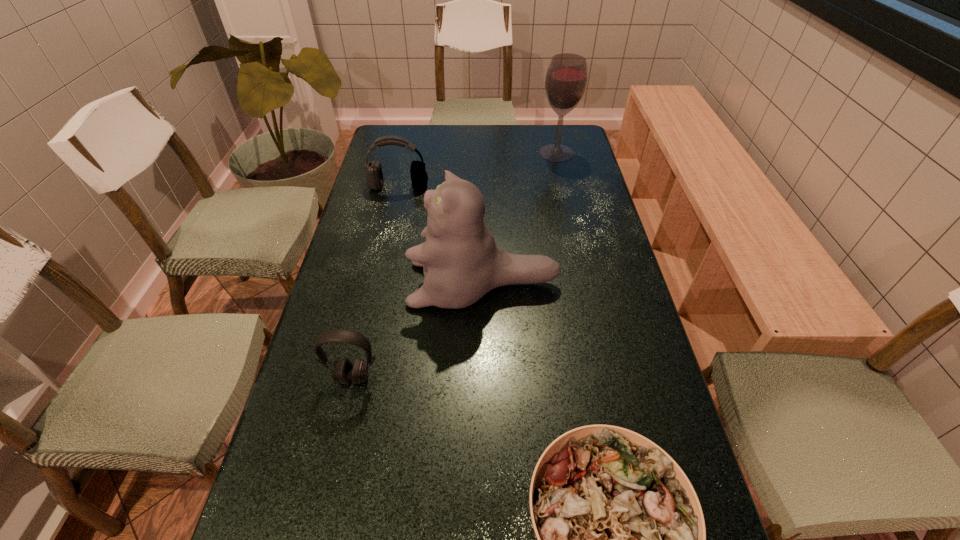
The height and width of the screenshot is (540, 960). Identify the location of the closest object to the alcohol. (374, 177).

You are a GUI agent. You are given a task and a screenshot of the screen. Output one action in this format:
    pyautogui.click(x=<x>, y=<y>)
    Task: Click on the object that can be found as the closest to the second farthest object
    The image size is (960, 540).
    Given the screenshot: What is the action you would take?
    pyautogui.click(x=461, y=263)